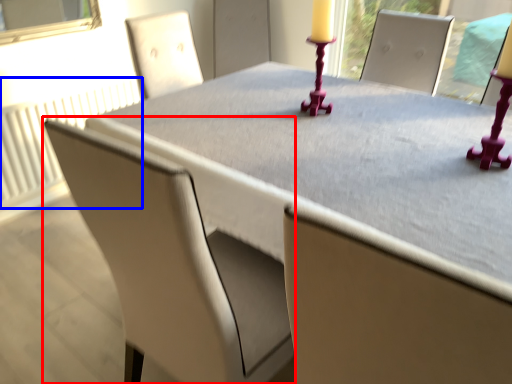
Question: Which point is further to the camera, chair (highlighted by a red box) or radiator (highlighted by a blue box)?

Choices:
 (A) chair
 (B) radiator

Answer: (B)